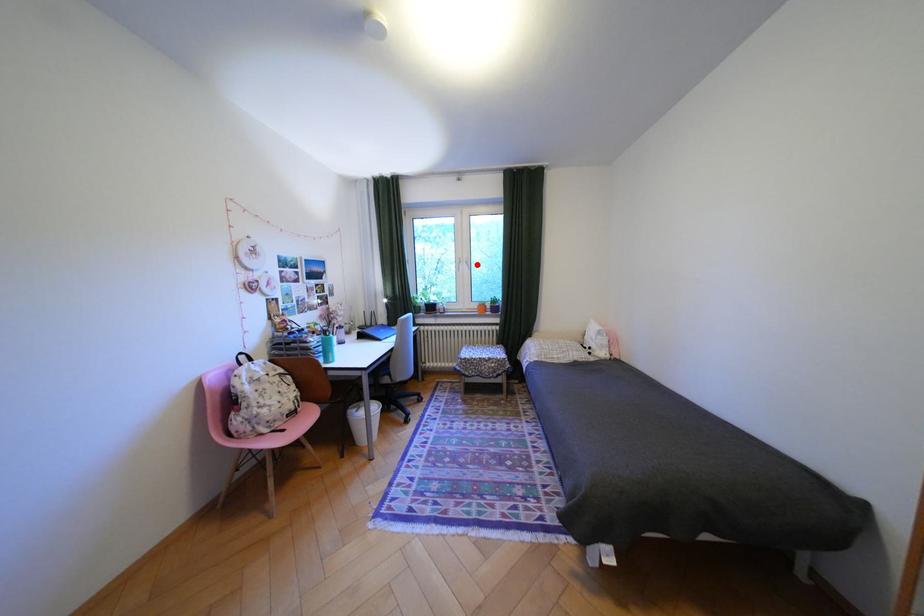
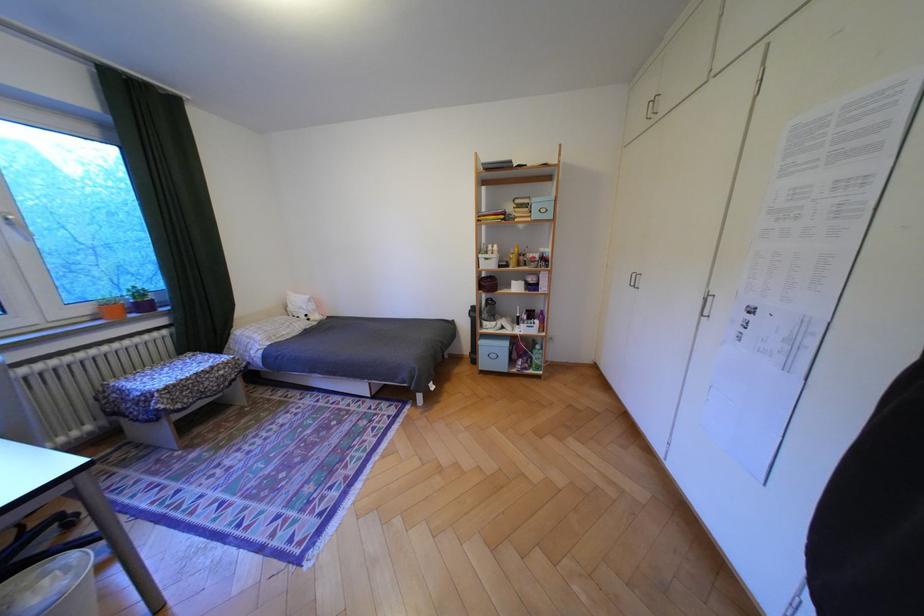
Question: I am providing you with two images of the same scene from different viewpoints. A red point is shown in image1. For the corresponding object point in image2, is it positioned nearer or farther from the camera?

Choices:
 (A) Nearer
 (B) Farther

Answer: (B)